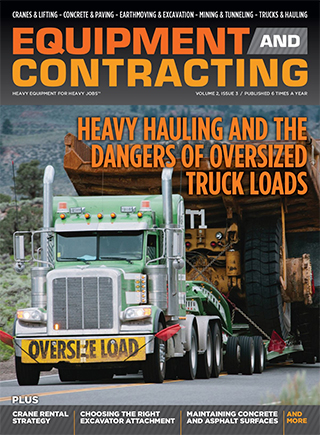
Where is `windows`? windows is located at coordinates (84, 249), (125, 245), (153, 246).